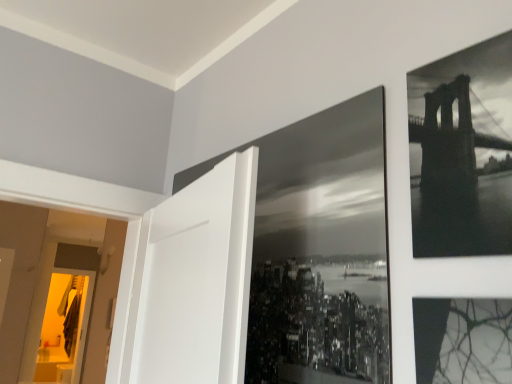
Question: From a real-world perspective, is monochrome metallic bridge at upper right positioned above or below black glossy photo frame at center?

Choices:
 (A) above
 (B) below

Answer: (A)

Question: From the image's perspective, is monochrome metallic bridge at upper right located above or below black glossy photo frame at center?

Choices:
 (A) above
 (B) below

Answer: (A)

Question: Looking at their shapes, would you say monochrome metallic bridge at upper right is wider or thinner than black glossy photo frame at center?

Choices:
 (A) wide
 (B) thin

Answer: (A)

Question: From the image's perspective, is black glossy photo frame at center located above or below monochrome metallic bridge at upper right?

Choices:
 (A) above
 (B) below

Answer: (B)

Question: Is black glossy photo frame at center in front of or behind monochrome metallic bridge at upper right in the image?

Choices:
 (A) front
 (B) behind

Answer: (B)

Question: Which is correct: black glossy photo frame at center is inside monochrome metallic bridge at upper right, or outside of it?

Choices:
 (A) outside
 (B) inside

Answer: (A)

Question: Is black glossy photo frame at center taller or shorter than monochrome metallic bridge at upper right?

Choices:
 (A) tall
 (B) short

Answer: (A)